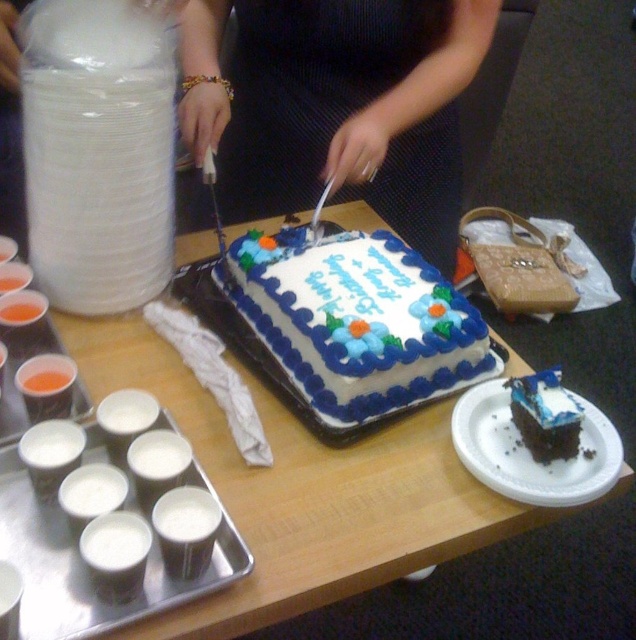
Question: Among these points, which one is farthest from the camera?

Choices:
 (A) (544, 426)
 (B) (422, 172)
 (C) (452, 440)

Answer: (B)

Question: Which object is farther from the camera taking this photo?

Choices:
 (A) white fondant cake at center
 (B) chocolate cake at lower right
 (C) white paper cups at lower left
 (D) white cardboard cake at center

Answer: (A)

Question: Can you confirm if white cardboard cake at center is positioned above white paper cups at lower left?

Choices:
 (A) no
 (B) yes

Answer: (B)

Question: Is the position of white fondant cake at center less distant than that of chocolate cake at center?

Choices:
 (A) no
 (B) yes

Answer: (A)

Question: Among these points, which one is farthest from the camera?

Choices:
 (A) (300, 444)
 (B) (32, 557)

Answer: (A)

Question: Is white cardboard cake at center thinner than white paper cups at lower left?

Choices:
 (A) no
 (B) yes

Answer: (A)